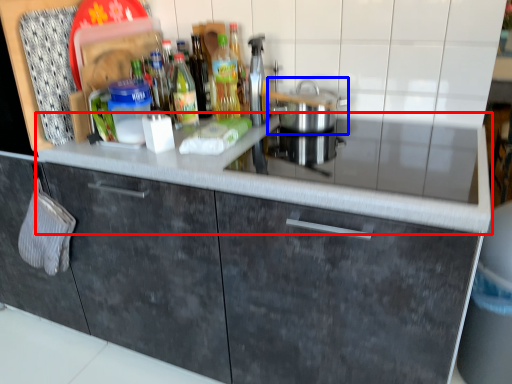
Question: Which object appears farthest to the camera in this image, countertop (highlighted by a red box) or home appliance (highlighted by a blue box)?

Choices:
 (A) countertop
 (B) home appliance

Answer: (B)